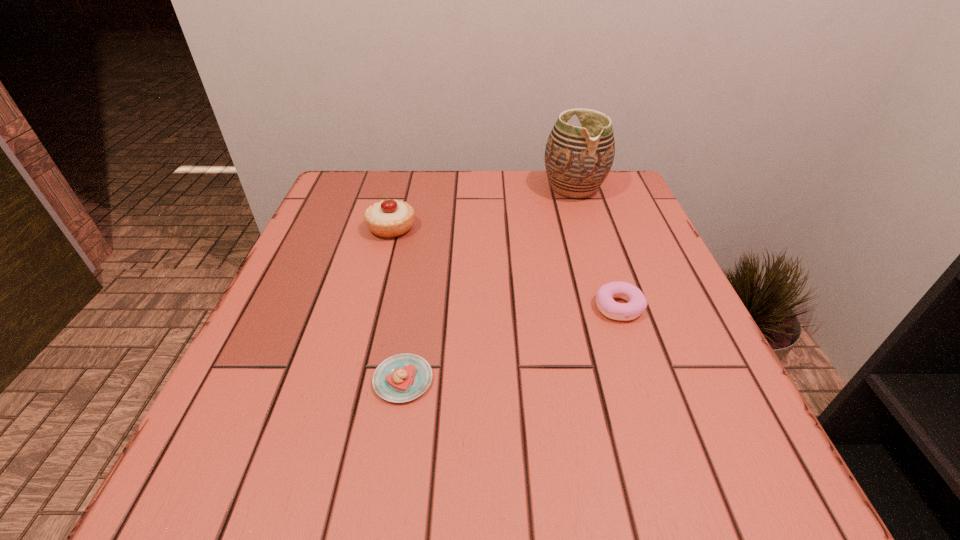
I want to click on the farthest object, so click(578, 159).

Locate an element on the screen. The height and width of the screenshot is (540, 960). the tallest object is located at coordinates (578, 159).

Locate an element on the screen. The width and height of the screenshot is (960, 540). the third nearest object is located at coordinates click(x=391, y=218).

This screenshot has width=960, height=540. I want to click on the farthest pastry, so click(x=391, y=218).

Find the location of a particular element. The image size is (960, 540). the second farthest pastry is located at coordinates (637, 303).

This screenshot has height=540, width=960. In order to click on the second shortest object in this screenshot , I will do `click(637, 303)`.

The width and height of the screenshot is (960, 540). In order to click on the nearest pastry in this screenshot , I will do `click(404, 377)`.

Find the location of `the shortest object`. the shortest object is located at coordinates (404, 377).

Image resolution: width=960 pixels, height=540 pixels. Find the location of `free space located 0.280m on the left of the farthest object`. free space located 0.280m on the left of the farthest object is located at coordinates (433, 188).

What are the coordinates of `free region located on the back of the third shortest object` in the screenshot? It's located at (400, 193).